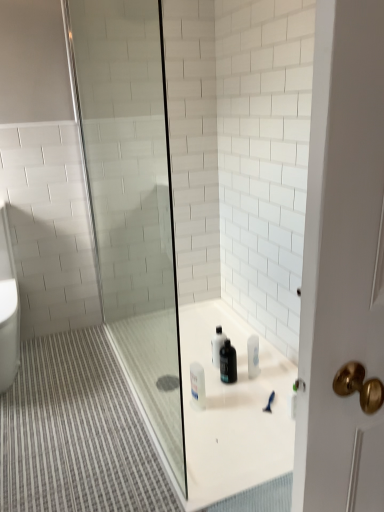
This screenshot has height=512, width=384. What do you see at coordinates (228, 362) in the screenshot? I see `black matte bottle at center` at bounding box center [228, 362].

Where is `black matte bottle at center`? This screenshot has height=512, width=384. black matte bottle at center is located at coordinates (228, 362).

This screenshot has width=384, height=512. I want to click on transparent glass shower door at center, so click(x=132, y=197).

Measure the distance between transparent glass shower door at center and camera.

They are 6.71 feet apart.

Measure the distance between point (110, 85) and camera.

Point (110, 85) and camera are 2.23 meters apart from each other.

What do you see at coordinates (132, 197) in the screenshot?
I see `transparent glass shower door at center` at bounding box center [132, 197].

Locate an element on the screen. black matte bottle at center is located at coordinates (228, 362).

Can you confirm if transparent glass shower door at center is positioned to the right of black matte bottle at center?

In fact, transparent glass shower door at center is to the left of black matte bottle at center.

Looking at this image, is transparent glass shower door at center in front of or behind black matte bottle at center in the image?

Clearly, transparent glass shower door at center is in front of black matte bottle at center.

Is point (150, 292) more distant than point (230, 351)?

Yes, point (150, 292) is behind point (230, 351).

From the image's perspective, between transparent glass shower door at center and black matte bottle at center, which one is located above?

transparent glass shower door at center.

From a real-world perspective, which is physically above, transparent glass shower door at center or black matte bottle at center?

transparent glass shower door at center, from a real-world perspective.

Can you confirm if transparent glass shower door at center is thinner than black matte bottle at center?

Incorrect, the width of transparent glass shower door at center is not less than that of black matte bottle at center.

Does transparent glass shower door at center have a lesser height compared to black matte bottle at center?

No.

In the scene shown: In terms of size, does transparent glass shower door at center appear bigger or smaller than black matte bottle at center?

Considering their sizes, transparent glass shower door at center takes up more space than black matte bottle at center.

Do you think transparent glass shower door at center is within black matte bottle at center, or outside of it?

transparent glass shower door at center is not enclosed by black matte bottle at center.

From the picture: Are transparent glass shower door at center and black matte bottle at center beside each other?

No.

Is transparent glass shower door at center positioned with its back to black matte bottle at center?

No, transparent glass shower door at center's orientation is not away from black matte bottle at center.

Measure the distance between transparent glass shower door at center and black matte bottle at center.

transparent glass shower door at center and black matte bottle at center are 1.10 meters apart.

This screenshot has height=512, width=384. In the image, there is a transparent glass shower door at center. Identify the location of cleaning product below it (from a real-world perspective). (228, 362).

Which is more to the right, black matte bottle at center or transparent glass shower door at center?

Positioned to the right is black matte bottle at center.

In the image, is black matte bottle at center positioned in front of or behind transparent glass shower door at center?

black matte bottle at center is behind transparent glass shower door at center.

Which point is more forward, (236, 375) or (77, 77)?

The point (236, 375) is closer.

From the image's perspective, is black matte bottle at center beneath transparent glass shower door at center?

Yes.

From a real-world perspective, is black matte bottle at center located higher than transparent glass shower door at center?

Actually, black matte bottle at center is physically below transparent glass shower door at center in the real world.

Which of these two, black matte bottle at center or transparent glass shower door at center, is thinner?

black matte bottle at center is thinner.

Does black matte bottle at center have a greater height compared to transparent glass shower door at center?

No, black matte bottle at center is not taller than transparent glass shower door at center.

Considering the relative sizes of black matte bottle at center and transparent glass shower door at center in the image provided, is black matte bottle at center bigger than transparent glass shower door at center?

No, black matte bottle at center is not bigger than transparent glass shower door at center.

Is black matte bottle at center not inside transparent glass shower door at center?

Yes, black matte bottle at center is not within transparent glass shower door at center.

Is black matte bottle at center not close to transparent glass shower door at center?

black matte bottle at center is far away from transparent glass shower door at center.

Is black matte bottle at center looking in the opposite direction of transparent glass shower door at center?

black matte bottle at center does not have its back to transparent glass shower door at center.

Can you tell me how much black matte bottle at center and transparent glass shower door at center differ in facing direction?

87.1 degrees separate the facing orientations of black matte bottle at center and transparent glass shower door at center.

In order to click on shower door located above the black matte bottle at center (from the image's perspective) in this screenshot , I will do `click(132, 197)`.

You are a GUI agent. You are given a task and a screenshot of the screen. Output one action in this format:
    pyautogui.click(x=<x>, y=<y>)
    Task: Click on the cleaning product behind the transparent glass shower door at center
    The width and height of the screenshot is (384, 512).
    Given the screenshot: What is the action you would take?
    pyautogui.click(x=228, y=362)

Locate an element on the screen. Image resolution: width=384 pixels, height=512 pixels. shower door that is on the left side of black matte bottle at center is located at coordinates (132, 197).